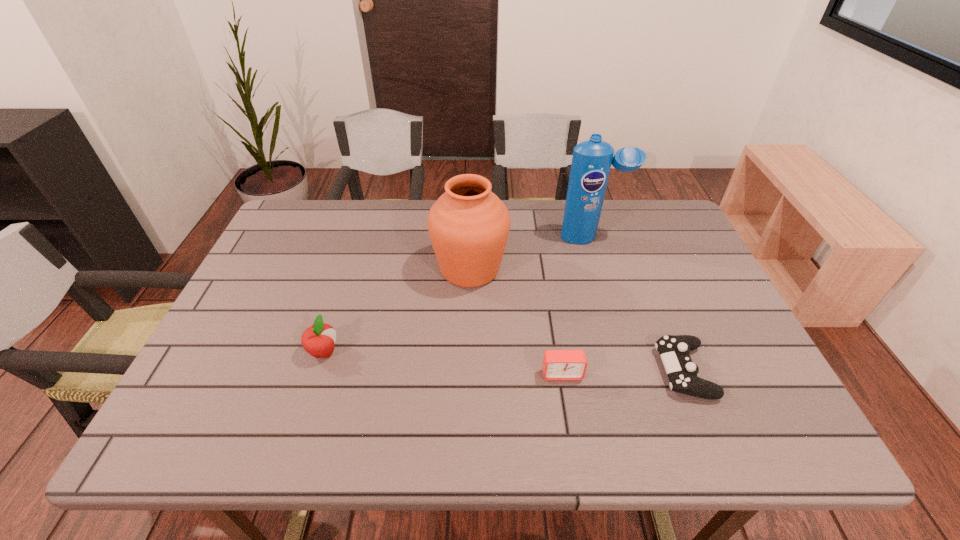
Locate an element on the screen. The height and width of the screenshot is (540, 960). the tallest object is located at coordinates (591, 162).

Where is `the fourth shortest object`? This screenshot has height=540, width=960. the fourth shortest object is located at coordinates (468, 225).

Identify the location of the second object from left to right. (468, 225).

Locate an element on the screen. apple is located at coordinates (318, 340).

Identify the location of the third tallest object. This screenshot has width=960, height=540. (318, 340).

I want to click on the second shortest object, so coord(557,364).

The image size is (960, 540). In order to click on alarm clock in this screenshot , I will do `click(557, 364)`.

You are a GUI agent. You are given a task and a screenshot of the screen. Output one action in this format:
    pyautogui.click(x=<x>, y=<y>)
    Task: Click on the control
    
    Given the screenshot: What is the action you would take?
    pyautogui.click(x=674, y=350)

Find the location of a particular element. vacant space located on the back of the tallest object is located at coordinates (582, 205).

What are the coordinates of `free region located on the front of the fourth shortest object` in the screenshot? It's located at (468, 313).